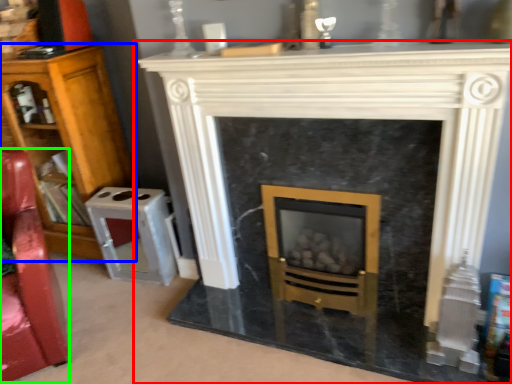
Question: Based on their relative distances, which object is nearer to fireplace (highlighted by a red box)? Choose from bookcase (highlighted by a blue box) and swivel chair (highlighted by a green box).

Choices:
 (A) bookcase
 (B) swivel chair

Answer: (B)